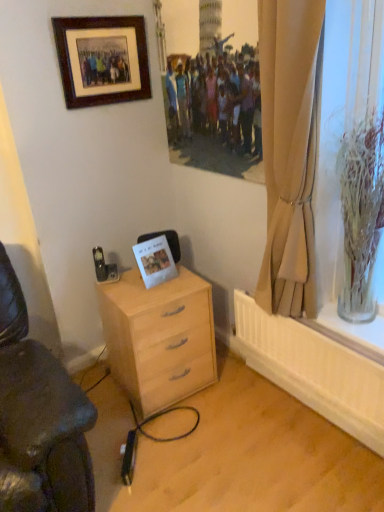
What do you see at coordinates (361, 215) in the screenshot? The height and width of the screenshot is (512, 384). I see `clear glass vase at right` at bounding box center [361, 215].

The height and width of the screenshot is (512, 384). What do you see at coordinates (290, 150) in the screenshot? I see `beige fabric curtain at right` at bounding box center [290, 150].

What is the approximate width of light wood/finish desk at lower center?

The width of light wood/finish desk at lower center is 47.15 centimeters.

This screenshot has width=384, height=512. What do you see at coordinates (155, 261) in the screenshot?
I see `white paper postcard at center` at bounding box center [155, 261].

Identify the location of wooden picture frame at upper left. Image resolution: width=384 pixels, height=512 pixels. (102, 59).

Where is `clear glass vase at right`? The height and width of the screenshot is (512, 384). clear glass vase at right is located at coordinates (361, 215).

Looking at this image, is beige fabric curtain at right touching wooden picture frame at upper left?

No, beige fabric curtain at right is not making contact with wooden picture frame at upper left.

Between beige fabric curtain at right and wooden picture frame at upper left, which one has less height?

wooden picture frame at upper left is shorter.

Is beige fabric curtain at right at the right side of wooden picture frame at upper left?

Yes.

The image size is (384, 512). In order to click on picture frame above the beige fabric curtain at right (from a real-world perspective) in this screenshot , I will do `click(102, 59)`.

Is point (312, 246) positioned behind point (105, 292)?

No, (312, 246) is closer to viewer.

Would you say beige fabric curtain at right is outside light wood/finish desk at lower center?

That's correct, beige fabric curtain at right is outside of light wood/finish desk at lower center.

In the scene shown: Could you tell me if beige fabric curtain at right is facing light wood/finish desk at lower center?

No.

Which of these two, beige fabric curtain at right or light wood/finish desk at lower center, stands shorter?

light wood/finish desk at lower center.

Which is behind, point (210, 347) or point (272, 223)?

The point (210, 347) is behind.

Where is `desk located behind the beige fabric curtain at right`? Image resolution: width=384 pixels, height=512 pixels. desk located behind the beige fabric curtain at right is located at coordinates (159, 337).

Between light wood/finish desk at lower center and beige fabric curtain at right, which one appears on the left side from the viewer's perspective?

From the viewer's perspective, light wood/finish desk at lower center appears more on the left side.

Is beige fabric curtain at right surrounded by light wood/finish desk at lower center?

No, beige fabric curtain at right is not surrounded by light wood/finish desk at lower center.

Would you say light wood/finish desk at lower center is outside clear glass vase at right?

Absolutely, light wood/finish desk at lower center is external to clear glass vase at right.

Which is behind, point (134, 368) or point (352, 271)?

Positioned behind is point (134, 368).

Is light wood/finish desk at lower center looking in the opposite direction of clear glass vase at right?

No.

Considering the relative positions of light wood/finish desk at lower center and clear glass vase at right in the image provided, is light wood/finish desk at lower center to the right of clear glass vase at right from the viewer's perspective?

No.

Can we say clear glass vase at right lies outside beige fabric curtain at right?

That's correct, clear glass vase at right is outside of beige fabric curtain at right.

In the scene shown: From a real-world perspective, is clear glass vase at right on top of beige fabric curtain at right?

No, from a real-world perspective, clear glass vase at right is not over beige fabric curtain at right

Which is in front, point (298, 228) or point (167, 248)?

The point (298, 228) is more forward.

From the image's perspective, relative to white paper postcard at center, is beige fabric curtain at right above or below?

From the image's perspective, beige fabric curtain at right appears above white paper postcard at center.

Locate an element on the screen. curtain that appears in front of the white paper postcard at center is located at coordinates (290, 150).

Is white paper postcard at center at the back of beige fabric curtain at right?

No.

Between wooden picture frame at upper left and clear glass vase at right, which one appears on the right side from the viewer's perspective?

clear glass vase at right is more to the right.

From the image's perspective, who appears lower, wooden picture frame at upper left or clear glass vase at right?

clear glass vase at right, from the image's perspective.

Identify the location of picture frame located behind the clear glass vase at right. (102, 59).

You are a GUI agent. You are given a task and a screenshot of the screen. Output one action in this format:
    pyautogui.click(x=<x>, y=<y>)
    Task: Click on the picture frame above the beige fabric curtain at right (from the image's perspective)
    
    Given the screenshot: What is the action you would take?
    pyautogui.click(x=102, y=59)

Locate an element on the screen. desk located on the left of beige fabric curtain at right is located at coordinates (159, 337).

Based on their spatial positions, is beige fabric curtain at right or clear glass vase at right closer to wooden picture frame at upper left?

beige fabric curtain at right lies closer to wooden picture frame at upper left than the other object.

From the image, which object appears to be farther from white paper postcard at center, light wood/finish desk at lower center or beige fabric curtain at right?

beige fabric curtain at right.

Considering their positions, is white paper postcard at center positioned closer to beige fabric curtain at right than light wood/finish desk at lower center?

Based on the image, light wood/finish desk at lower center appears to be nearer to beige fabric curtain at right.

When comparing their distances from white paper postcard at center, does beige fabric curtain at right or wooden picture frame at upper left seem closer?

Among the two, beige fabric curtain at right is located nearer to white paper postcard at center.

Based on their spatial positions, is light wood/finish desk at lower center or beige fabric curtain at right further from clear glass vase at right?

light wood/finish desk at lower center lies further to clear glass vase at right than the other object.

Which object lies further to the anchor point clear glass vase at right, white paper postcard at center or light wood/finish desk at lower center?

white paper postcard at center is further to clear glass vase at right.

Based on their spatial positions, is beige fabric curtain at right or white paper postcard at center closer to light wood/finish desk at lower center?

Among the two, white paper postcard at center is located nearer to light wood/finish desk at lower center.

Which object lies further to the anchor point light wood/finish desk at lower center, beige fabric curtain at right or wooden picture frame at upper left?

wooden picture frame at upper left is positioned further to the anchor light wood/finish desk at lower center.

You are a GUI agent. You are given a task and a screenshot of the screen. Output one action in this format:
    pyautogui.click(x=<x>, y=<y>)
    Task: Click on the postcard that lies between wooden picture frame at upper left and light wood/finish desk at lower center from top to bottom
    This screenshot has width=384, height=512.
    Given the screenshot: What is the action you would take?
    pyautogui.click(x=155, y=261)

Find the location of a particular element. The width and height of the screenshot is (384, 512). curtain between wooden picture frame at upper left and white paper postcard at center vertically is located at coordinates click(290, 150).

Where is `glass vase between wooden picture frame at upper left and light wood/finish desk at lower center in the up-down direction`? Image resolution: width=384 pixels, height=512 pixels. glass vase between wooden picture frame at upper left and light wood/finish desk at lower center in the up-down direction is located at coordinates (361, 215).

Locate an element on the screen. desk between beige fabric curtain at right and white paper postcard at center from front to back is located at coordinates (159, 337).